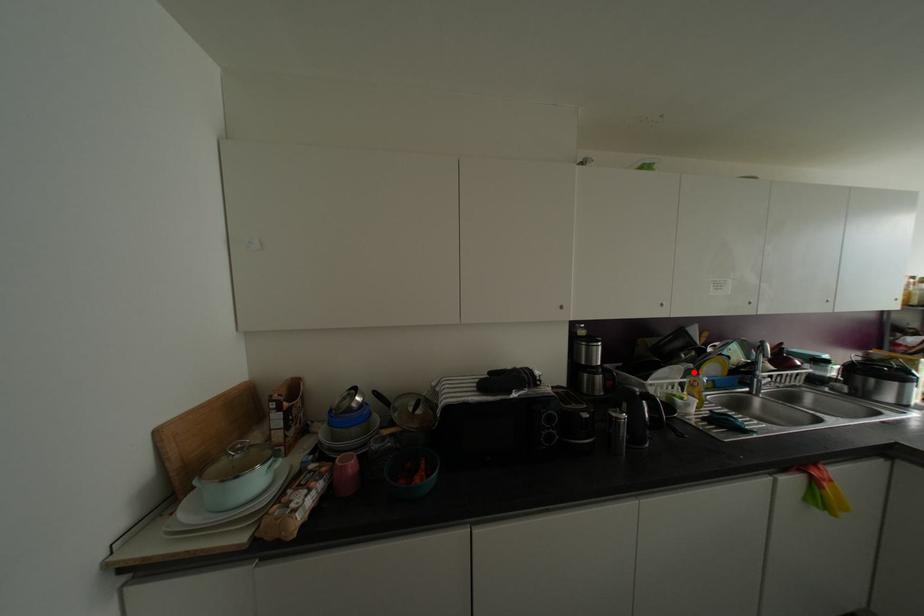
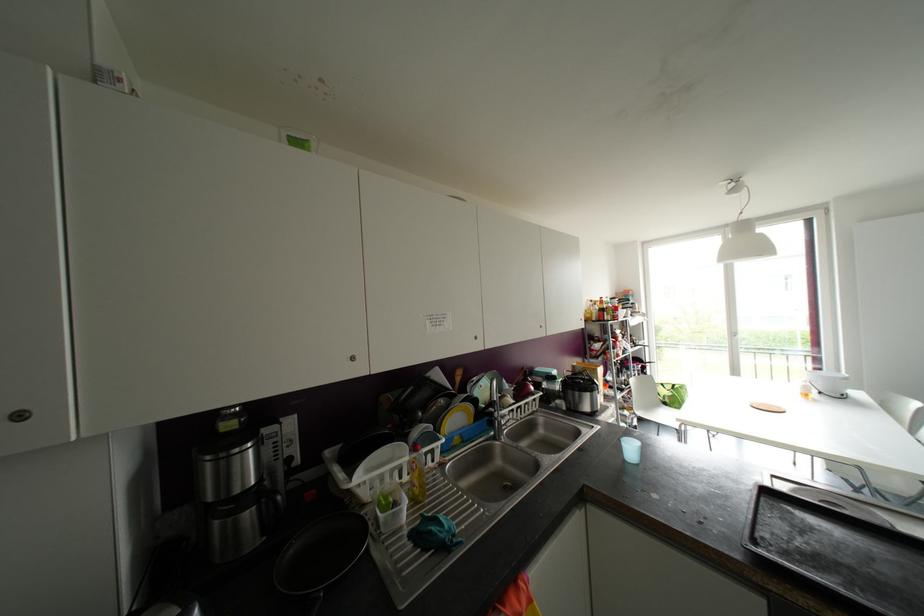
Question: A red point is marked in image1. In image2, is the corresponding 3D point closer to the camera or farther? Reply with the corresponding letter.

Choices:
 (A) The corresponding 3D point is closer.
 (B) The corresponding 3D point is farther.

Answer: (A)